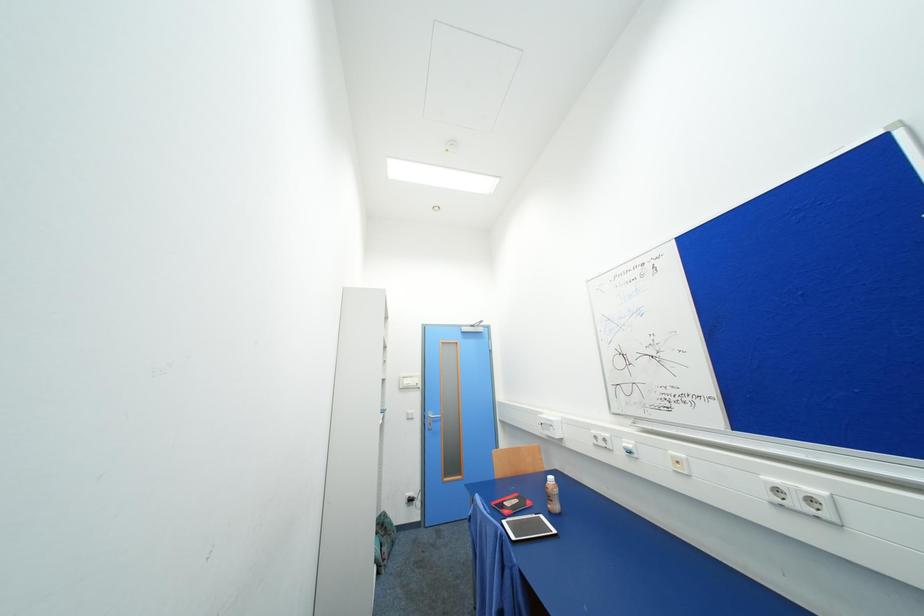
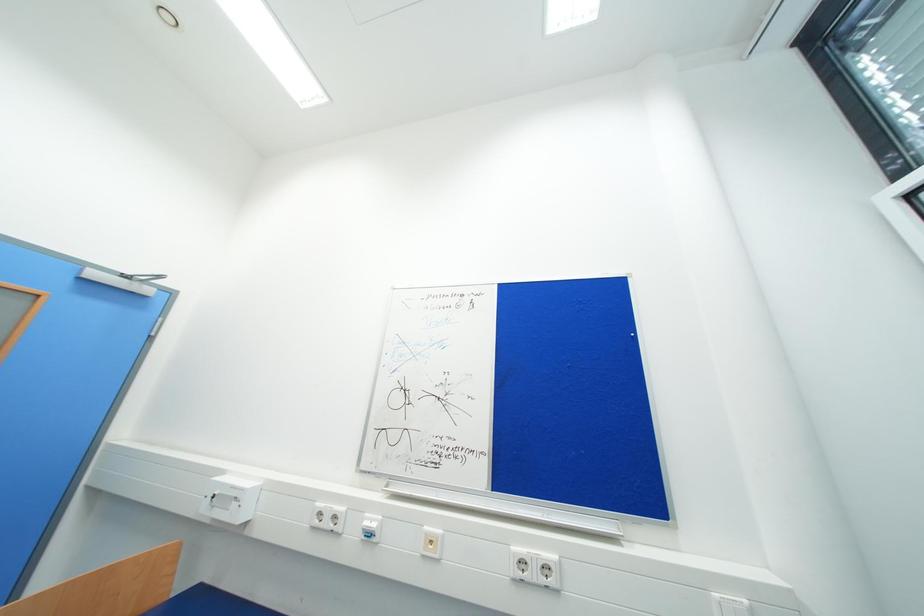
Question: The camera is either moving clockwise (left) or counter-clockwise (right) around the object. The first image is from the beginning of the video and the second image is from the end. Is the camera moving left or right when shooting the video?

Choices:
 (A) Left
 (B) Right

Answer: (A)